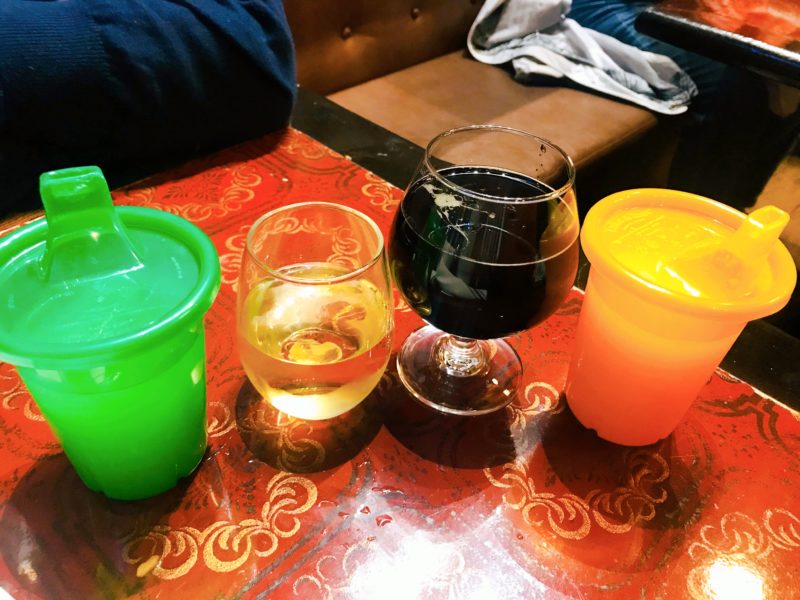
Locate an element on the screen. cushion is located at coordinates (193, 100).